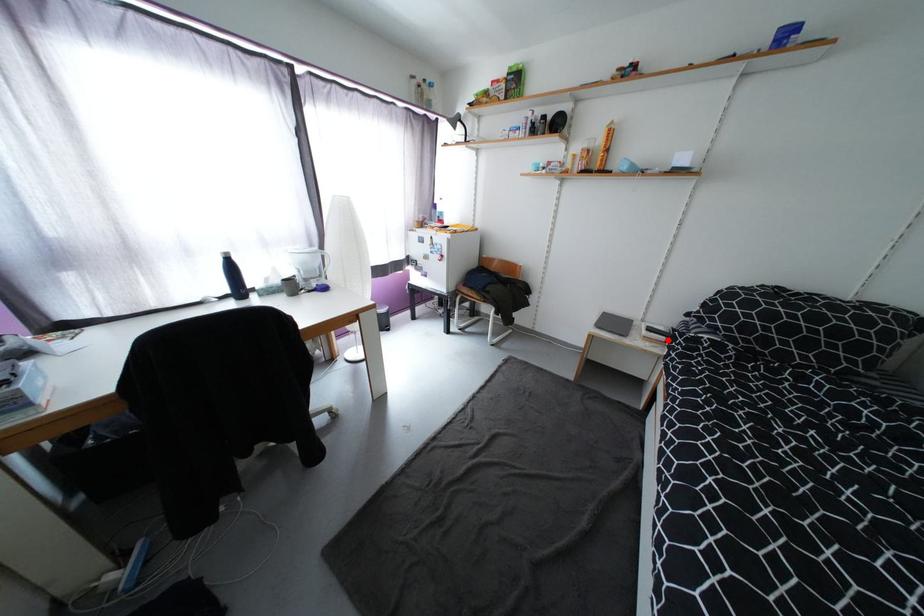
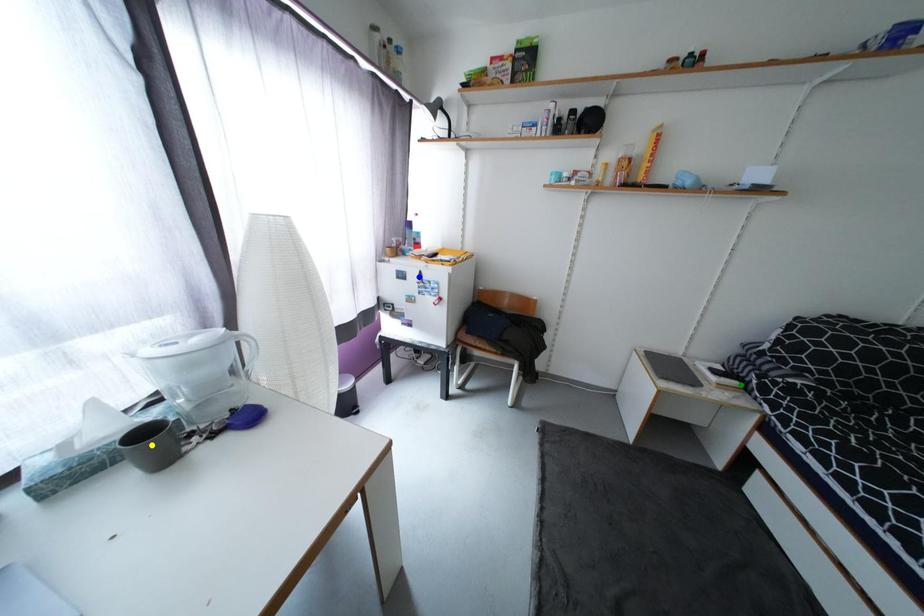
Question: I am providing you with two images of the same scene from different viewpoints. A red point is marked on the first image. You are given multiple points on the second image. Can you choose the point in image 2 that corresponds to the point in image 1?

Choices:
 (A) green point
 (B) blue point
 (C) yellow point

Answer: (A)